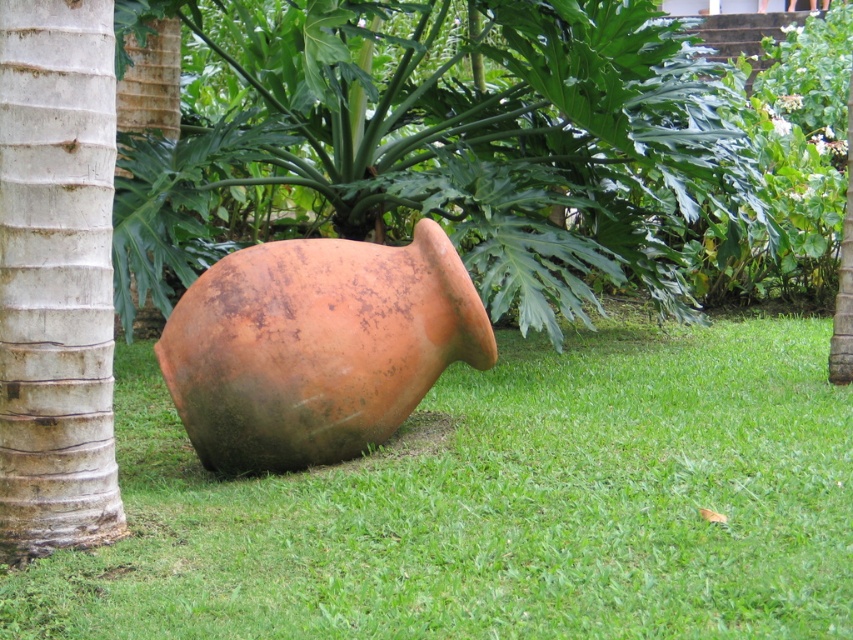
You are a gardener who needs to water the coconut tree. You have a watering can in your hand. The coconut tree is brown matte coconut tree at center and the pot is rusty clay pot at center. Which object is closer to you, the coconut tree or the pot?

The brown matte coconut tree at center is closer to you than the rusty clay pot at center, so you should water the coconut tree first before reaching the pot.

You are standing in the garden and see the white textured tree trunk at left and the smooth brown bark at left. Which tree trunk is more to the right?

The white textured tree trunk at left is positioned on the right side of smooth brown bark at left, so it is more to the right.